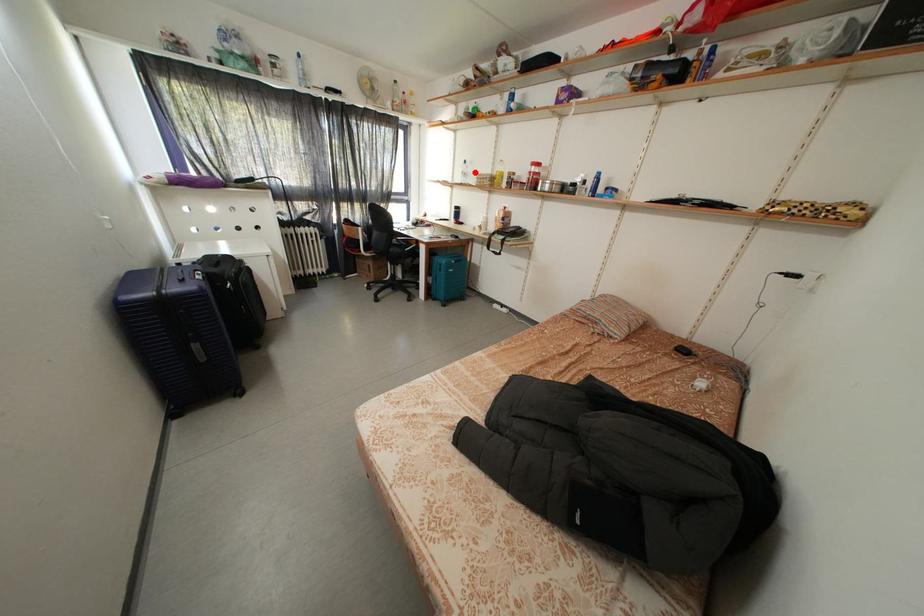
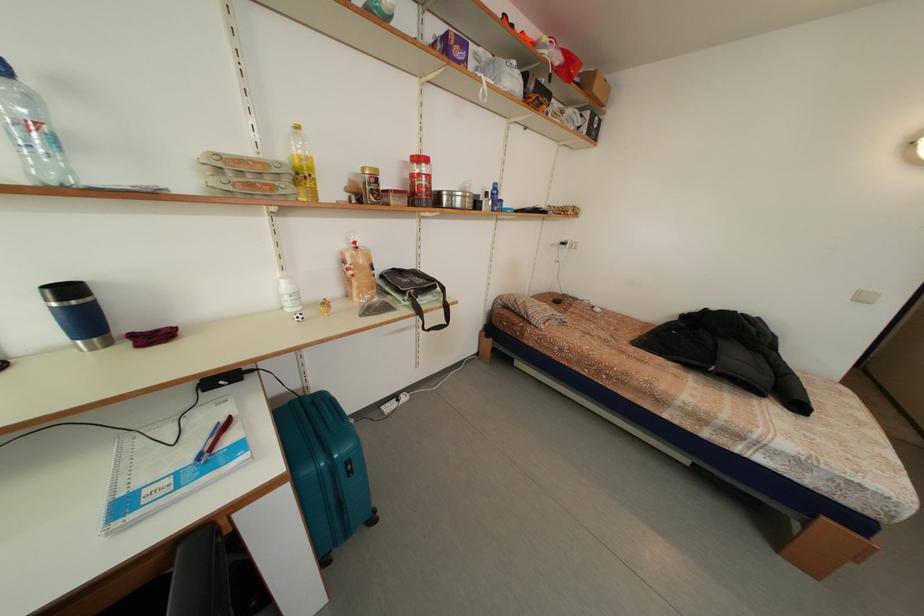
Where in the second image is the point corresponding to the highlighted location from the first image?

(40, 106)